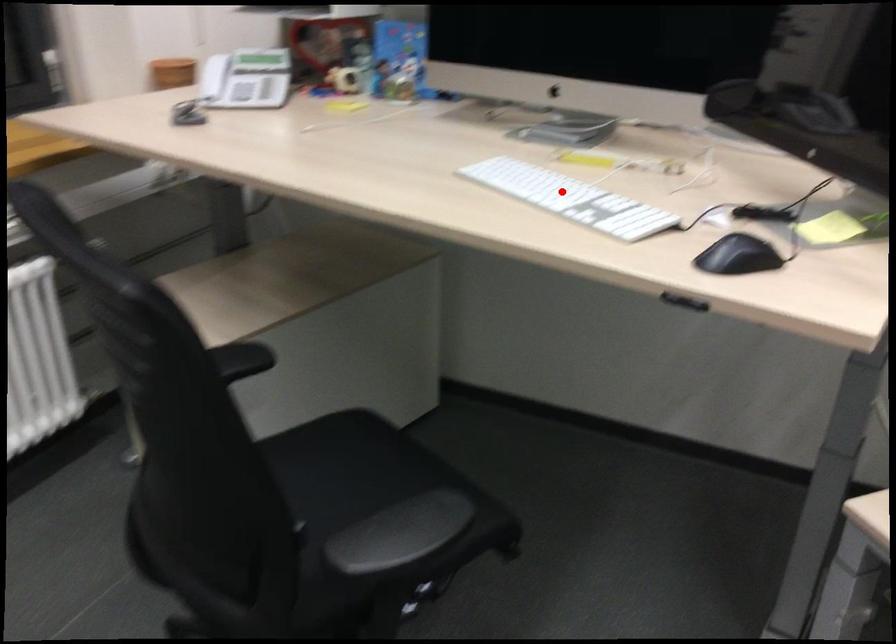
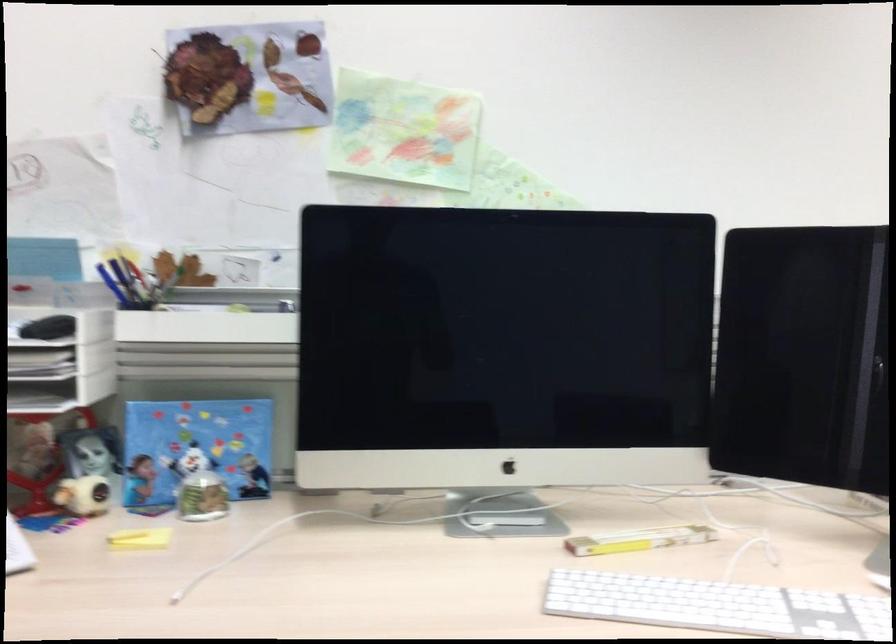
Question: I am providing you with two images of the same scene from different viewpoints. Given a red point in image1, look at the same physical point in image2. Is it:

Choices:
 (A) Closer to the viewpoint
 (B) Farther from the viewpoint

Answer: (A)